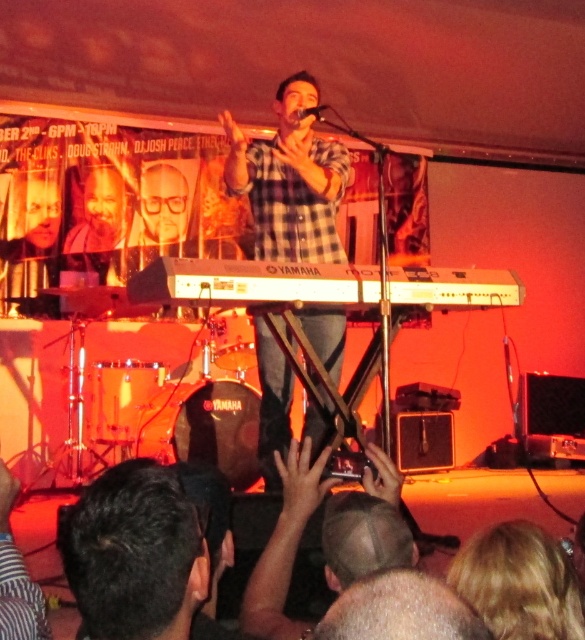
You are a sound technician setting up for a live performance. You need to adjust the microphone stand so that the metallic silver microphone at center is positioned to the left of the white plastic keyboard at center. Is the microphone currently in the correct position?

The white plastic keyboard at center is currently to the right of the metallic silver microphone at center, so the microphone is already positioned to the left of the keyboard. Therefore, it is in the correct position.

You are a photographer at the live performance scene. You need to capture a closeup shot of the performer. The point at coordinates (290, 180) marks the center of the checkered fabric shirt. Where should you aim your camera to ensure the performer is centered in the frame?

Aim your camera at the point marked by coordinates (290, 180) to center the checkered fabric shirt at center, ensuring the performer is centered in the frame.

You are a photographer at the venue and need to adjust your camera settings to focus on both the checkered fabric shirt at center and the metallic silver microphone at center. Since the shirt is taller than the microphone, which object should you prioritize focusing on first to ensure both are in focus?

The checkered fabric shirt at center has a greater height compared to the metallic silver microphone at center, so you should prioritize focusing on the checkered fabric shirt at center first to ensure both are in focus.